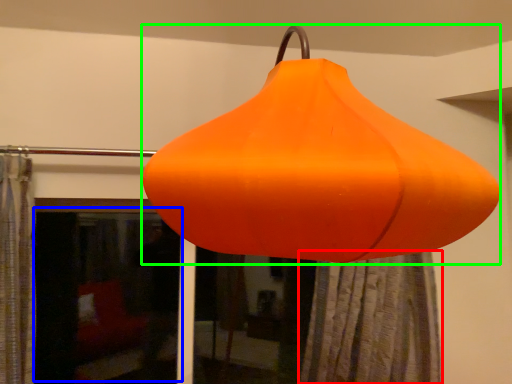
Question: Which object is positioned closest to shower curtain (highlighted by a red box)? Select from window screen (highlighted by a blue box) and lantern (highlighted by a green box).

Choices:
 (A) window screen
 (B) lantern

Answer: (B)